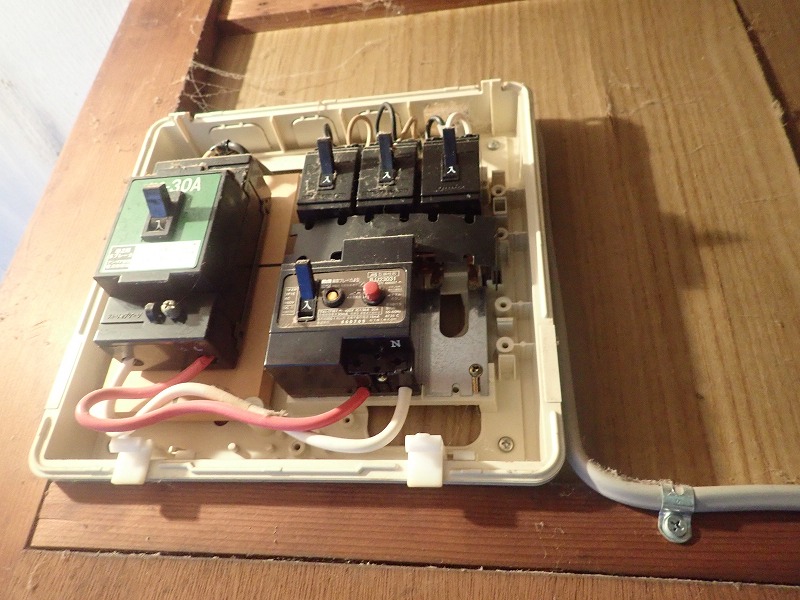
The image size is (800, 600). What are the coordinates of `wall` in the screenshot? It's located at coord(742,377).